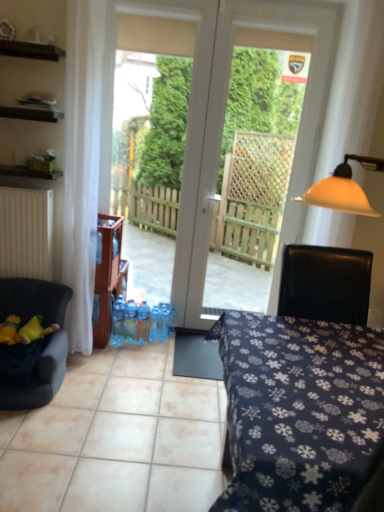
You are a GUI agent. You are given a task and a screenshot of the screen. Output one action in this format:
    pyautogui.click(x=<x>, y=<y>)
    Task: Click on the vacant area that is situated to the right of blue plastic bottle at center, marked as the third bottle in a left-to-right arrangement
    
    Given the screenshot: What is the action you would take?
    pyautogui.click(x=165, y=345)